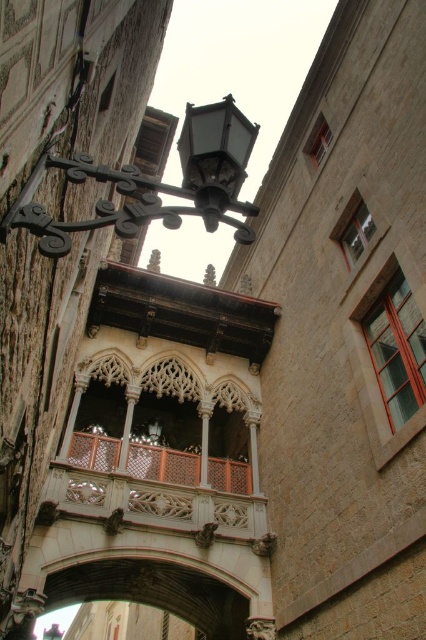
Question: Which object is farther from the camera taking this photo?

Choices:
 (A) matte black lantern at upper left
 (B) carved wood balcony at center

Answer: (B)

Question: Observing the image, what is the correct spatial positioning of matte black lantern at upper left in reference to matte black lantern at upper center?

Choices:
 (A) left
 (B) right

Answer: (A)

Question: Does matte black lantern at upper left appear under carved wood balcony at center?

Choices:
 (A) yes
 (B) no

Answer: (B)

Question: Which point is farther to the camera?

Choices:
 (A) matte black lantern at upper center
 (B) matte black lantern at upper left

Answer: (A)

Question: Which of the following is the closest to the observer?

Choices:
 (A) matte black lantern at upper left
 (B) carved wood balcony at center
 (C) matte black lantern at upper center

Answer: (A)

Question: From the image, what is the correct spatial relationship of matte black lantern at upper left in relation to matte black lantern at upper center?

Choices:
 (A) below
 (B) above

Answer: (A)